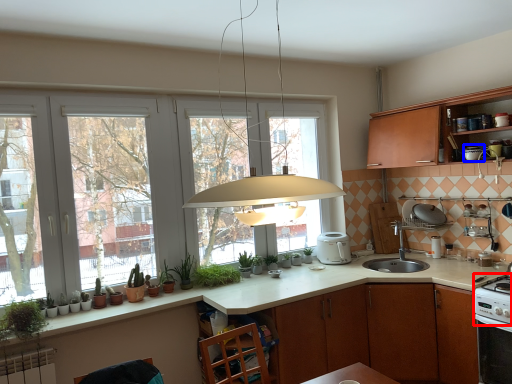
Question: Which of the following is the closest to the observer, gas stove (highlighted by a red box) or appliance (highlighted by a blue box)?

Choices:
 (A) gas stove
 (B) appliance

Answer: (A)